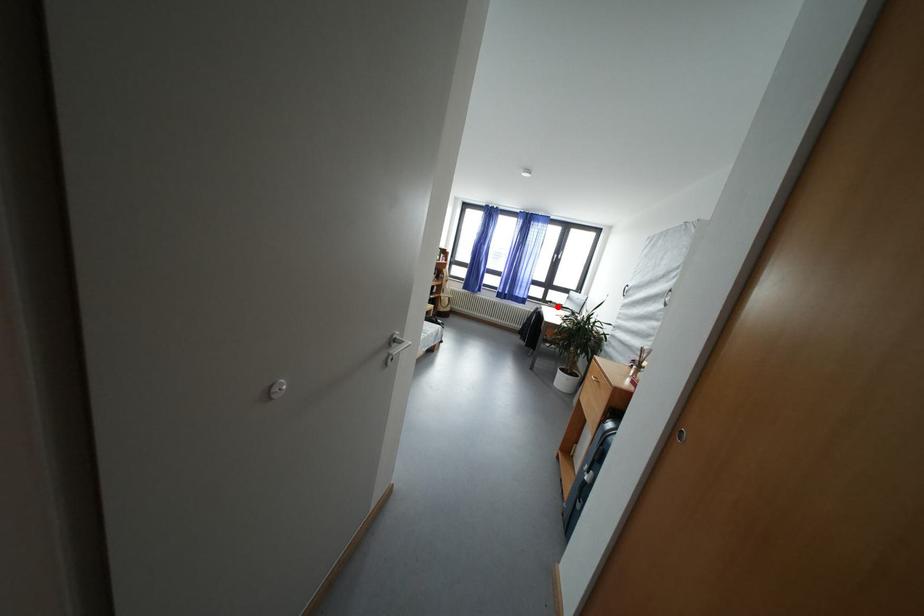
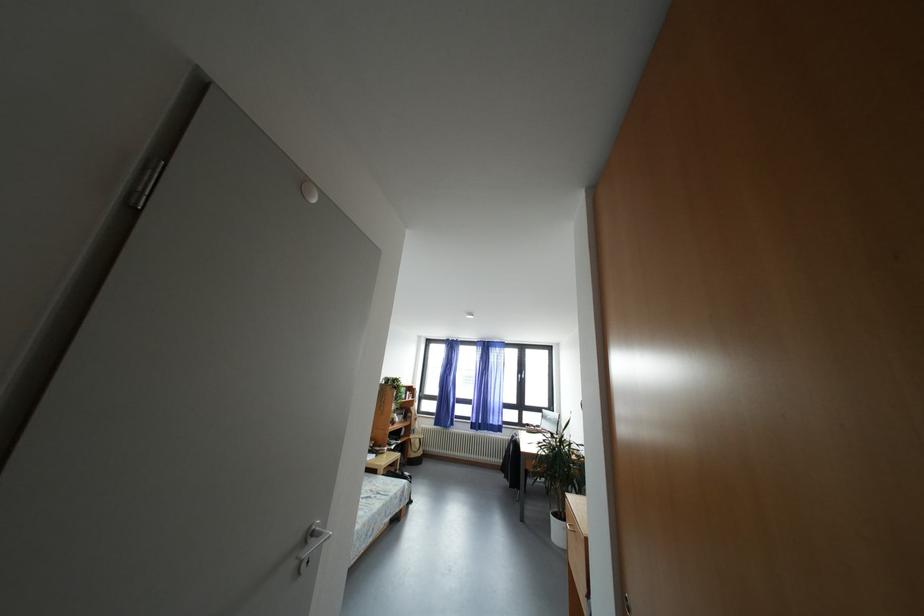
Question: I am providing you with two images of the same scene from different viewpoints. Given a red point in image1, look at the same physical point in image2. Is it:

Choices:
 (A) Closer to the viewpoint
 (B) Farther from the viewpoint

Answer: (B)